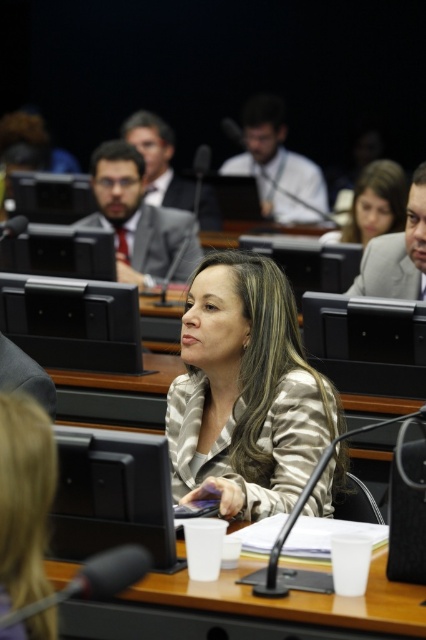
Can you confirm if silky beige blazer at center is positioned above matte gray suit at upper left?

Incorrect, silky beige blazer at center is not positioned above matte gray suit at upper left.

Is silky beige blazer at center thinner than matte gray suit at upper left?

Yes, silky beige blazer at center is thinner than matte gray suit at upper left.

This screenshot has width=426, height=640. Describe the element at coordinates (245, 390) in the screenshot. I see `silky beige blazer at center` at that location.

The height and width of the screenshot is (640, 426). I want to click on silky beige blazer at center, so click(x=245, y=390).

Is matte gray suit at upper left shorter than matte gold blouse at upper center?

In fact, matte gray suit at upper left may be taller than matte gold blouse at upper center.

Is point (132, 225) positioned behind point (382, 172)?

Yes, it is behind point (382, 172).

I want to click on matte gray suit at upper left, so click(138, 220).

Which of these two, silky beige blazer at center or white plastic cups at center, stands shorter?

white plastic cups at center

Does silky beige blazer at center appear over white plastic cups at center?

Yes.

What do you see at coordinates (245, 390) in the screenshot? I see `silky beige blazer at center` at bounding box center [245, 390].

You are a GUI agent. You are given a task and a screenshot of the screen. Output one action in this format:
    pyautogui.click(x=<x>, y=<y>)
    Task: Click on the silky beige blazer at center
    The image size is (426, 640).
    Given the screenshot: What is the action you would take?
    pyautogui.click(x=245, y=390)